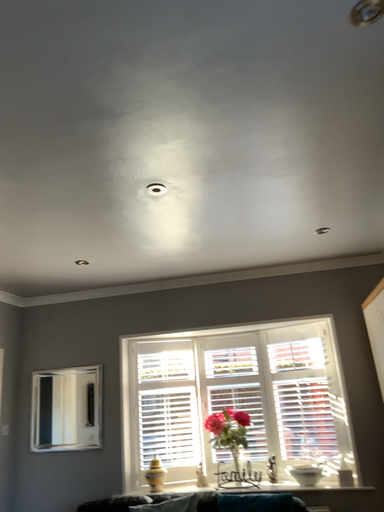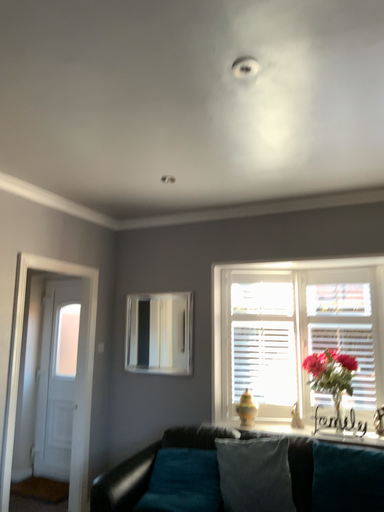
Question: How did the camera likely rotate when shooting the video?

Choices:
 (A) rotated left
 (B) rotated right

Answer: (A)